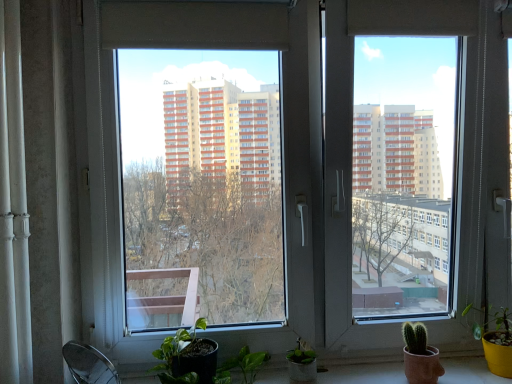
Question: Is transparent glass window at center wider than matte yellow pot at lower right?

Choices:
 (A) yes
 (B) no

Answer: (B)

Question: Can you confirm if transparent glass window at center is shorter than matte yellow pot at lower right?

Choices:
 (A) no
 (B) yes

Answer: (A)

Question: From the image's perspective, is transparent glass window at center over matte yellow pot at lower right?

Choices:
 (A) no
 (B) yes

Answer: (B)

Question: Is transparent glass window at center to the left of matte yellow pot at lower right from the viewer's perspective?

Choices:
 (A) yes
 (B) no

Answer: (A)

Question: Is transparent glass window at center looking in the opposite direction of matte yellow pot at lower right?

Choices:
 (A) yes
 (B) no

Answer: (A)

Question: From a real-world perspective, relative to white glossy curtain at left, is matte yellow pot at lower right vertically above or below?

Choices:
 (A) below
 (B) above

Answer: (A)

Question: Is matte yellow pot at lower right bigger or smaller than white glossy curtain at left?

Choices:
 (A) small
 (B) big

Answer: (B)

Question: Is matte yellow pot at lower right in front of or behind white glossy curtain at left in the image?

Choices:
 (A) behind
 (B) front

Answer: (A)

Question: From the image's perspective, is matte yellow pot at lower right positioned above or below white glossy curtain at left?

Choices:
 (A) below
 (B) above

Answer: (A)

Question: Is transparent glass window at center taller or shorter than white glossy window sill at lower center?

Choices:
 (A) tall
 (B) short

Answer: (A)

Question: Is transparent glass window at center bigger or smaller than white glossy window sill at lower center?

Choices:
 (A) big
 (B) small

Answer: (A)

Question: Considering the relative positions of transparent glass window at center and white glossy window sill at lower center in the image provided, is transparent glass window at center to the left or to the right of white glossy window sill at lower center?

Choices:
 (A) right
 (B) left

Answer: (A)

Question: Is point (233, 200) closer or farther from the camera than point (358, 377)?

Choices:
 (A) farther
 (B) closer

Answer: (A)

Question: Is transparent glass window at center situated inside white glossy curtain at left or outside?

Choices:
 (A) inside
 (B) outside

Answer: (B)

Question: Does point (125, 147) appear closer or farther from the camera than point (18, 281)?

Choices:
 (A) farther
 (B) closer

Answer: (A)